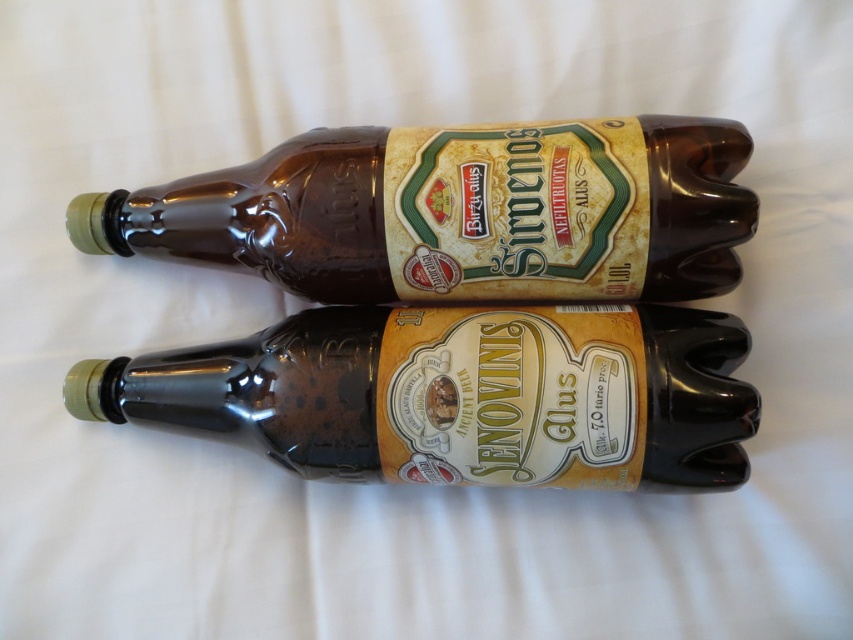
You are a delivery person who needs to place a new bottle exactly where the point is. The point is at coordinates (460, 394). Can you confirm if there is space there?

The point at coordinates (460, 394) marks the location of the shiny brown glass bottle at center, so there is no space available there.